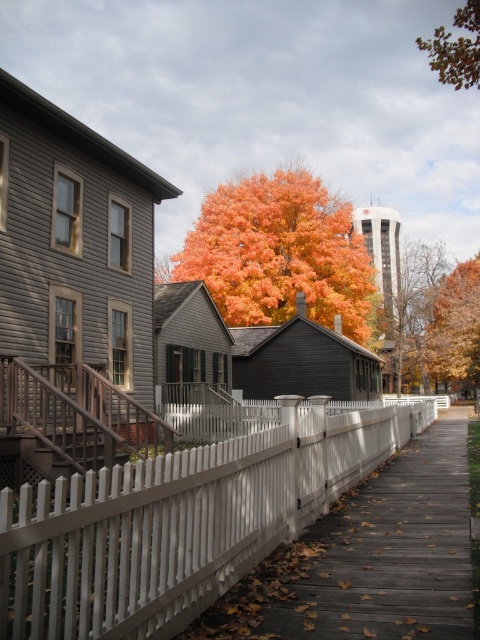
Measure the distance between orange leafy tree at center and orange matte tree at upper right.

14.14 meters

Does orange leafy tree at center have a smaller size compared to orange matte tree at upper right?

No.

Find the location of a particular element. orange leafy tree at center is located at coordinates (280, 252).

Can you confirm if white picket fence at center is thinner than orange matte tree at upper right?

No.

Which is behind, point (177, 468) or point (477, 273)?

Point (477, 273)

Identify the location of white picket fence at center. (180, 522).

What do you see at coordinates (180, 522) in the screenshot? Image resolution: width=480 pixels, height=640 pixels. I see `white picket fence at center` at bounding box center [180, 522].

Between white picket fence at center and brown leafy tree at upper right, which one is positioned higher?

brown leafy tree at upper right is above.

Measure the distance between point (255, 481) and camera.

Point (255, 481) is 16.84 feet away from camera.

Image resolution: width=480 pixels, height=640 pixels. Find the location of `white picket fence at center`. white picket fence at center is located at coordinates (180, 522).